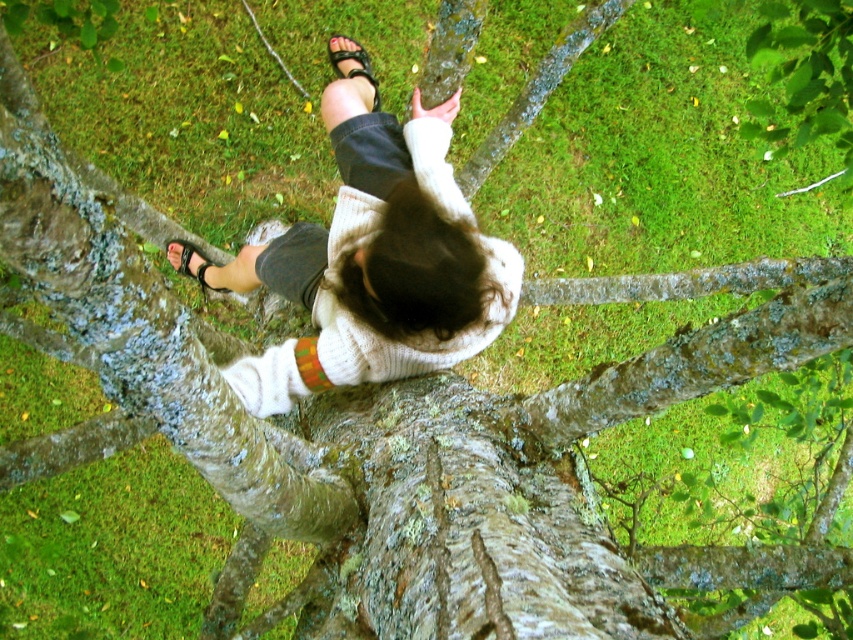
You are a photographer trying to capture the scene from above. You need to ensure the white knitted sweater at center and the black leather sandal at lower left are both visible in the frame. Based on their positions, which object should you prioritize keeping centered to ensure both are in the shot?

The white knitted sweater at center is to the right of the black leather sandal at lower left. To ensure both are in the frame, prioritize keeping the white knitted sweater at center centered, as it is already positioned more towards the middle of the scene compared to the sandal at the lower left.

You are a drone operator trying to capture a photo of the person sitting on the tree branch. The black leather sandal at center is represented by point (354,67). To ensure the sandal is in focus, where should you position the drone relative to the point?

The black leather sandal at center is represented by point (354,67), so the drone should be positioned directly above this point to ensure the sandal is in focus.

You are a photographer trying to capture the scene from above. You notice the white knitted sweater at center and the black leather sandal at lower left. Which object appears larger in the photo?

The white knitted sweater at center appears larger than the black leather sandal at lower left because it is taller.